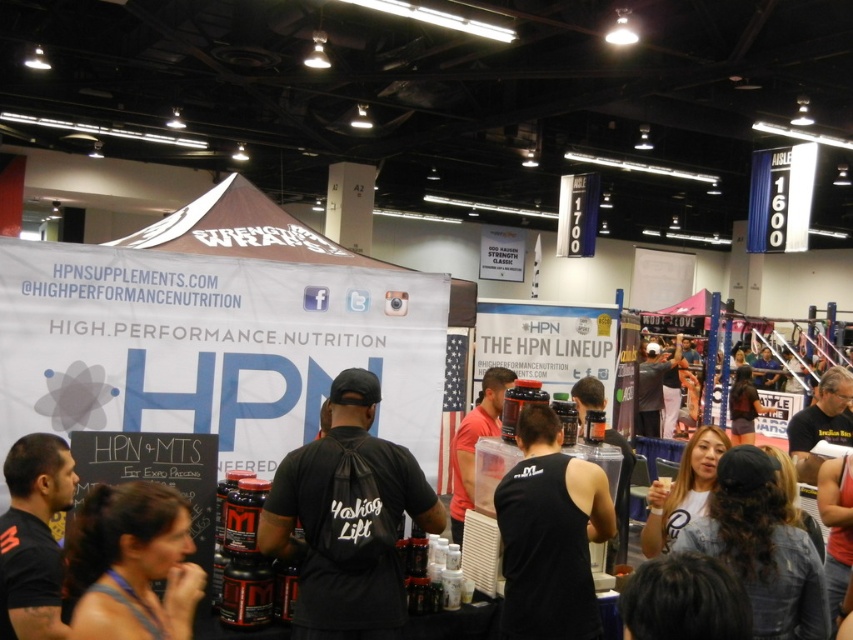
Question: Which point appears farthest from the camera in this image?

Choices:
 (A) (132, 536)
 (B) (463, 490)

Answer: (B)

Question: Does black matte tank top at center have a lesser width compared to black matte shirt at lower left?

Choices:
 (A) no
 (B) yes

Answer: (A)

Question: Observing the image, what is the correct spatial positioning of black matte tank top at center in reference to dark brown hair at lower left?

Choices:
 (A) right
 (B) left

Answer: (A)

Question: Can you confirm if dark brown hair at lower left is positioned below matte plastic container at center?

Choices:
 (A) no
 (B) yes

Answer: (A)

Question: Which of the following is the farthest from the observer?

Choices:
 (A) dark brown hair at lower left
 (B) black matte shirt at lower left
 (C) black matte tank top at center

Answer: (C)

Question: Considering the real-world distances, which object is closest to the matte plastic container at center?

Choices:
 (A) black matte t-shirt at center
 (B) black matte shirt at lower left
 (C) dark brown hair at lower left

Answer: (A)